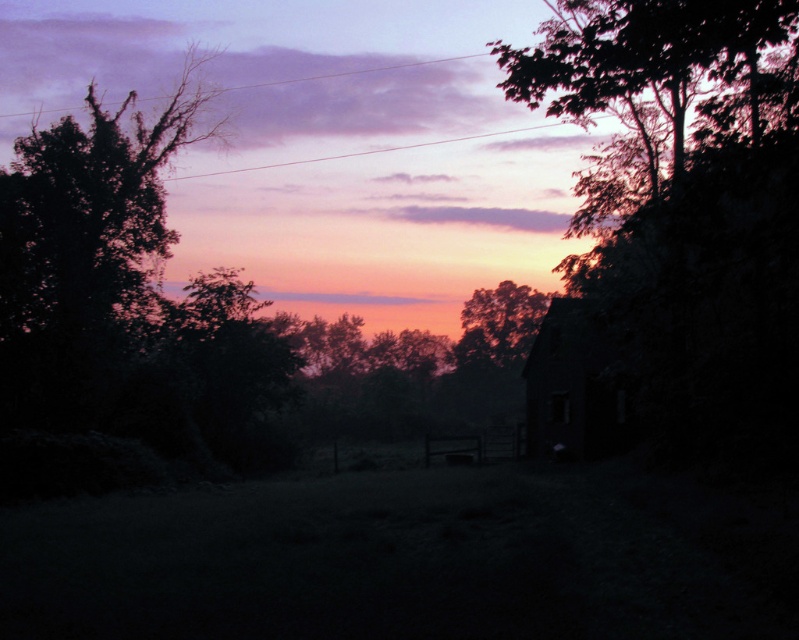
Question: Can you confirm if silhouette leafy tree at upper right is bigger than dark green leafy tree at left?

Choices:
 (A) no
 (B) yes

Answer: (A)

Question: Does dark brown wooden barn at right appear under silhouetted leafy tree at center?

Choices:
 (A) no
 (B) yes

Answer: (B)

Question: Which point is farther to the camera?

Choices:
 (A) [523, 321]
 (B) [108, 412]
 (C) [553, 433]
 (D) [762, 236]

Answer: (A)

Question: Is the position of silhouette leafy tree at upper right more distant than that of dark green leafy tree at left?

Choices:
 (A) no
 (B) yes

Answer: (A)

Question: Which object appears closest to the camera in this image?

Choices:
 (A) silhouetted leafy tree at center
 (B) dark brown wooden barn at right

Answer: (B)

Question: Estimate the real-world distances between objects in this image. Which object is closer to the dark green leafy tree at left?

Choices:
 (A) silhouette leafy tree at upper right
 (B) silhouetted leafy tree at center

Answer: (A)